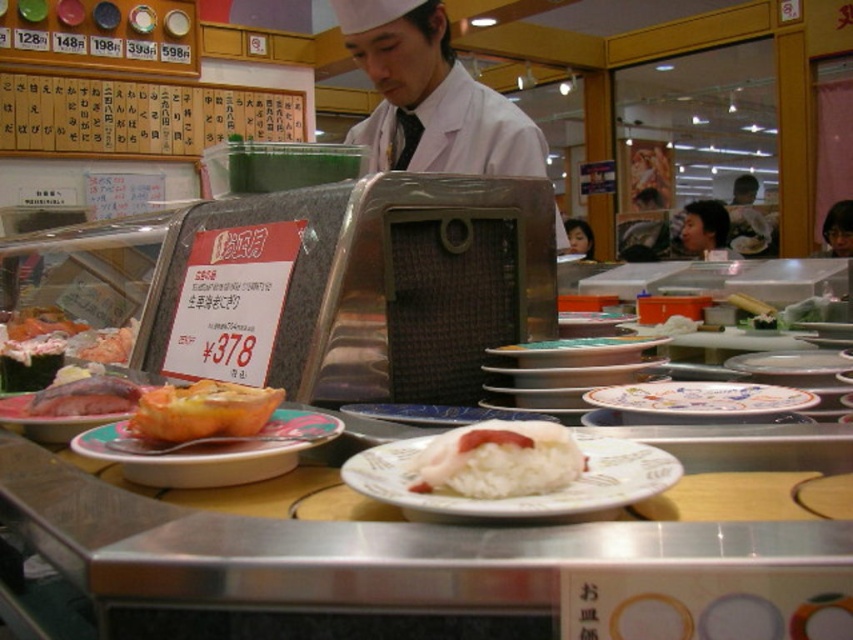
You are a customer at the conveyor belt sushi restaurant. You want to grab the matte ceramic plate at center before it moves out of reach. Based on its current position, which direction should you reach to intercept it?

The matte ceramic plate at center is located at point coordinates, so you should reach towards the center of the conveyor belt to intercept it before it moves further along the belt.

You are a customer at the conveyor belt sushi restaurant and want to grab a plate located at point (x=306, y=435). The restaurant requires that you can only reach up to 50 centimeters. Can you reach the plate?

The point (x=306, y=435) is 53.08 centimeters away from the camera, which is beyond your 50 centimeter reach limit. Therefore, you cannot reach the plate.

You are a customer at the conveyor belt sushi restaurant. You need to place your order by pointing at the wooden signboard at upper left and the white glossy plate at center. Which object is wider so you can point more accurately?

The wooden signboard at upper left is wider than the white glossy plate at center, so you can point more accurately at the wooden signboard at upper left.